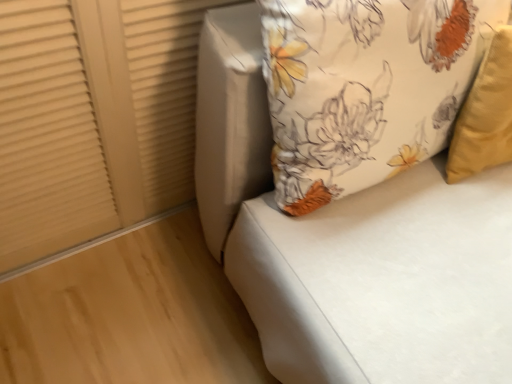
Question: Is floral fabric cushion at upper right turned away from matte beige shutter at upper left?

Choices:
 (A) no
 (B) yes

Answer: (A)

Question: Is floral fabric cushion at upper right further to the viewer compared to matte beige shutter at upper left?

Choices:
 (A) no
 (B) yes

Answer: (A)

Question: Is floral fabric cushion at upper right aimed at matte beige shutter at upper left?

Choices:
 (A) no
 (B) yes

Answer: (A)

Question: Can we say floral fabric cushion at upper right lies outside matte beige shutter at upper left?

Choices:
 (A) no
 (B) yes

Answer: (B)

Question: From the image's perspective, is floral fabric cushion at upper right on top of matte beige shutter at upper left?

Choices:
 (A) yes
 (B) no

Answer: (B)

Question: Visually, is matte beige shutter at upper left positioned to the left or to the right of floral fabric cushion at upper right?

Choices:
 (A) left
 (B) right

Answer: (A)

Question: Is matte beige shutter at upper left spatially inside floral fabric cushion at upper right, or outside of it?

Choices:
 (A) inside
 (B) outside

Answer: (B)

Question: From the image's perspective, is matte beige shutter at upper left positioned above or below floral fabric cushion at upper right?

Choices:
 (A) above
 (B) below

Answer: (A)

Question: In terms of height, does matte beige shutter at upper left look taller or shorter compared to floral fabric cushion at upper right?

Choices:
 (A) short
 (B) tall

Answer: (A)

Question: Does point (377, 56) appear closer or farther from the camera than point (339, 269)?

Choices:
 (A) closer
 (B) farther

Answer: (A)

Question: Relative to floral fabric cushion at upper right, is floral fabric pillow at upper right in front or behind?

Choices:
 (A) behind
 (B) front

Answer: (A)

Question: Is floral fabric pillow at upper right bigger or smaller than floral fabric cushion at upper right?

Choices:
 (A) big
 (B) small

Answer: (B)

Question: Is floral fabric pillow at upper right to the left or to the right of floral fabric cushion at upper right in the image?

Choices:
 (A) left
 (B) right

Answer: (A)

Question: In the image, is floral fabric cushion at upper right on the left side or the right side of floral fabric pillow at upper right?

Choices:
 (A) left
 (B) right

Answer: (B)

Question: From a real-world perspective, relative to floral fabric pillow at upper right, is floral fabric cushion at upper right vertically above or below?

Choices:
 (A) above
 (B) below

Answer: (B)